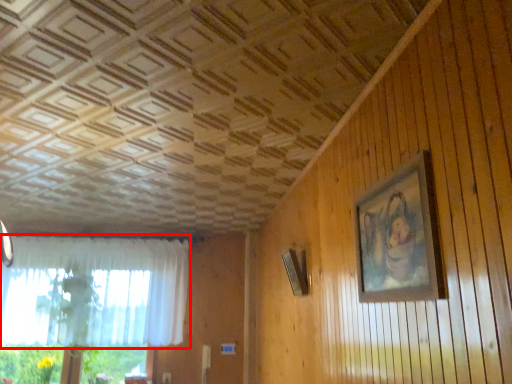
Question: Observing the image, what is the correct spatial positioning of curtain (annotated by the red box) in reference to picture frame?

Choices:
 (A) left
 (B) right

Answer: (A)